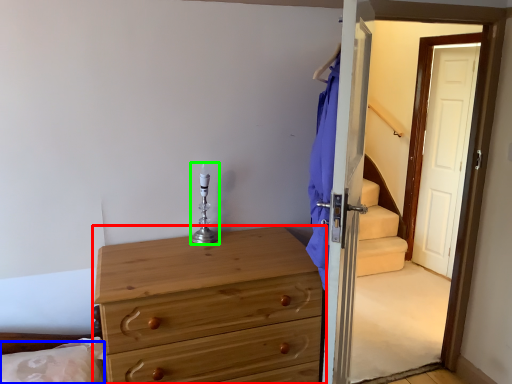
Question: Considering the real-world distances, which object is closest to chest of drawers (highlighted by a red box)? pillow (highlighted by a blue box) or candle holder (highlighted by a green box).

Choices:
 (A) pillow
 (B) candle holder

Answer: (B)